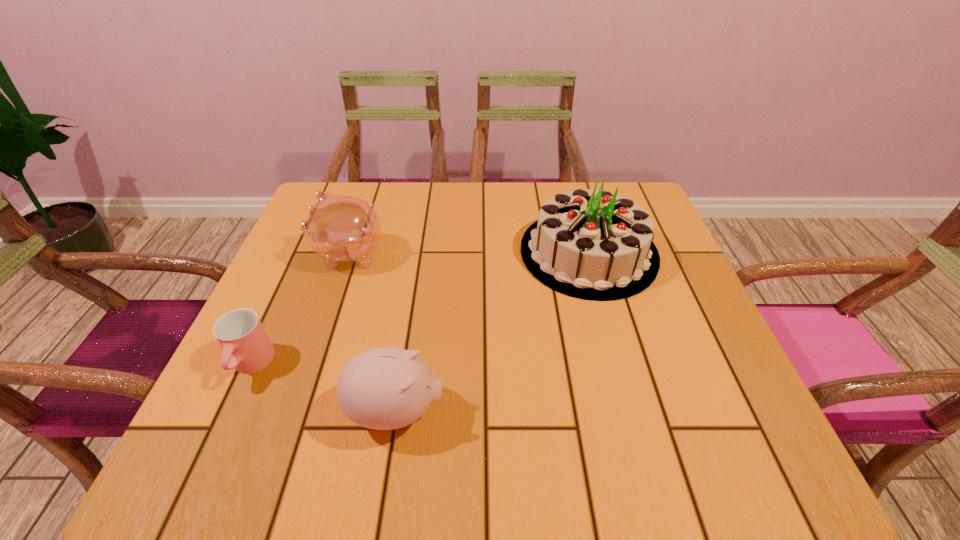
Locate an element on the screen. The image size is (960, 540). vacant space at the far left corner of the desktop is located at coordinates (355, 183).

At what (x,y) coordinates should I click in order to perform the action: click on blank space at the near left corner of the desktop. Please return your answer as a coordinate pair (x, y). This screenshot has width=960, height=540. Looking at the image, I should click on (227, 424).

At what (x,y) coordinates should I click in order to perform the action: click on vacant region between the tallest object and the second tallest object. Please return your answer as a coordinate pair (x, y). Image resolution: width=960 pixels, height=540 pixels. Looking at the image, I should click on (468, 253).

Find the location of a particular element. The image size is (960, 540). vacant space that's between the third tallest object and the cup is located at coordinates (324, 388).

Where is `blank region between the tallest object and the farther piggy bank`? The height and width of the screenshot is (540, 960). blank region between the tallest object and the farther piggy bank is located at coordinates (468, 253).

The image size is (960, 540). What are the coordinates of `vacant area that lies between the birthday cake and the shorter piggy bank` in the screenshot? It's located at (492, 332).

You are a GUI agent. You are given a task and a screenshot of the screen. Output one action in this format:
    pyautogui.click(x=<x>, y=<y>)
    Task: Click on the free space between the birthday cake and the shorter piggy bank
    
    Given the screenshot: What is the action you would take?
    (492, 332)

Locate an element on the screen. This screenshot has width=960, height=540. free space between the nearer piggy bank and the cup is located at coordinates (324, 388).

This screenshot has width=960, height=540. Find the location of `vacant space in between the taller piggy bank and the tallest object`. vacant space in between the taller piggy bank and the tallest object is located at coordinates (468, 253).

The height and width of the screenshot is (540, 960). In order to click on vacant space that is in between the nearer piggy bank and the cup in this screenshot , I will do `click(324, 388)`.